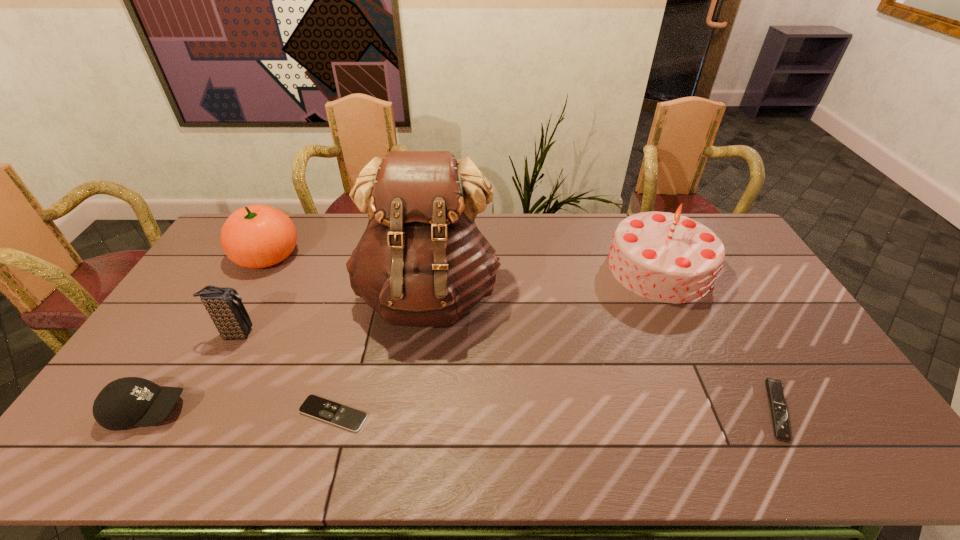
Where is `free space between the clutch bag and the satchel`? The width and height of the screenshot is (960, 540). free space between the clutch bag and the satchel is located at coordinates (332, 315).

Where is `blank region between the shortest object and the baseball cap`? This screenshot has height=540, width=960. blank region between the shortest object and the baseball cap is located at coordinates (240, 412).

This screenshot has width=960, height=540. I want to click on vacant space in between the pumpkin and the second shortest object, so click(521, 333).

This screenshot has height=540, width=960. In order to click on empty location between the third shortest object and the tallest object in this screenshot , I will do `click(288, 354)`.

Where is `free space between the pumpkin and the right remote control`? The image size is (960, 540). free space between the pumpkin and the right remote control is located at coordinates (521, 333).

I want to click on free space between the shortest object and the clutch bag, so click(x=285, y=374).

At what (x,y) coordinates should I click in order to perform the action: click on empty location between the taller remote control and the shortest object. Please return your answer as a coordinate pair (x, y). Looking at the image, I should click on (555, 412).

Locate an element on the screen. free spot between the pumpkin and the satchel is located at coordinates (348, 275).

Locate an element on the screen. vacant area that lies between the clutch bag and the taller remote control is located at coordinates (507, 372).

Where is `object that stands as the third closest to the shorter remote control`? This screenshot has height=540, width=960. object that stands as the third closest to the shorter remote control is located at coordinates (131, 401).